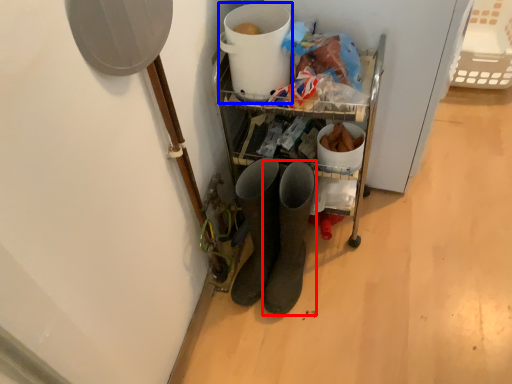
Question: Which point is closer to the camera, footwear (highlighted by a red box) or appliance (highlighted by a blue box)?

Choices:
 (A) footwear
 (B) appliance

Answer: (A)